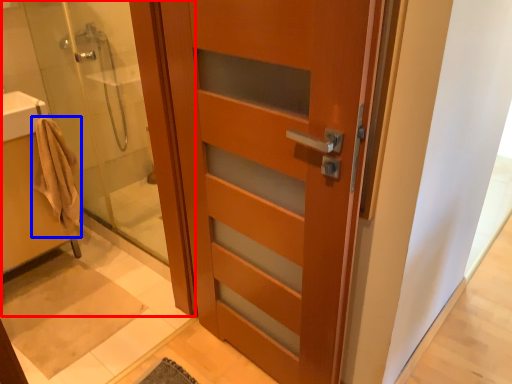
Question: Which object is further to the camera taking this photo, shower door (highlighted by a red box) or bathrobe (highlighted by a blue box)?

Choices:
 (A) shower door
 (B) bathrobe

Answer: (B)